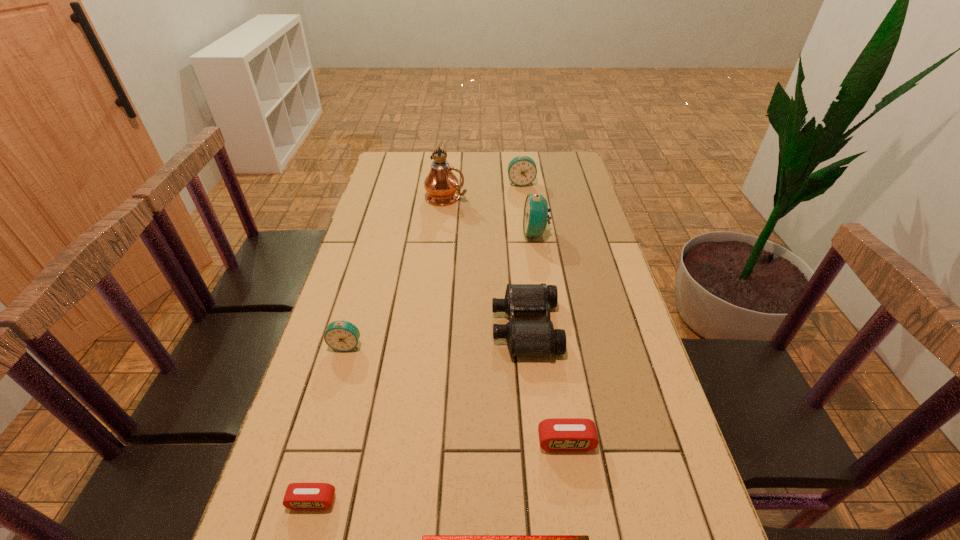
Image resolution: width=960 pixels, height=540 pixels. I want to click on vacant point located through the eyepieces of the binoculars, so click(429, 327).

Image resolution: width=960 pixels, height=540 pixels. I want to click on vacant space situated through the eyepieces of the binoculars, so click(429, 327).

Find the location of a particular element. The height and width of the screenshot is (540, 960). vacant region located 0.150m on the front-facing side of the right pink alarm clock is located at coordinates (580, 532).

Where is `object at the far edge`? object at the far edge is located at coordinates (522, 171).

In the image, there is a desktop. Where is `vacant region at the far edge`? Image resolution: width=960 pixels, height=540 pixels. vacant region at the far edge is located at coordinates (468, 156).

Locate an element on the screen. vacant space at the left edge is located at coordinates (406, 188).

In the image, there is a desktop. Identify the location of vacant space at the right edge. This screenshot has height=540, width=960. 599,245.

The height and width of the screenshot is (540, 960). I want to click on free space at the far left corner of the desktop, so click(415, 165).

Image resolution: width=960 pixels, height=540 pixels. Find the location of `vacant space at the far right corner of the desktop`. vacant space at the far right corner of the desktop is located at coordinates click(x=552, y=166).

Identify the location of free space between the binoculars and the seventh nearest object. The width and height of the screenshot is (960, 540). (486, 262).